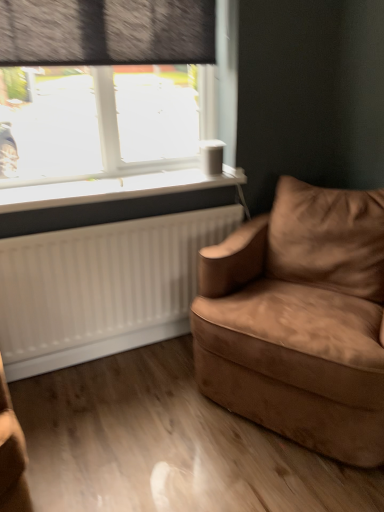
Find the location of a particular element. Image resolution: width=384 pixels, height=512 pixels. dark gray textured curtain at upper left is located at coordinates (106, 32).

The image size is (384, 512). Describe the element at coordinates (107, 32) in the screenshot. I see `transparent glass window at upper left` at that location.

Identify the location of dark gray textured curtain at upper left. (106, 32).

Is the surface of white plastic window sill at upper left in direct contact with suede brown armchair at right?

No.

Is suede brown armchair at right a part of white plastic window sill at upper left?

No.

Is white plastic window sill at upper left at the left side of suede brown armchair at right?

Indeed, white plastic window sill at upper left is positioned on the left side of suede brown armchair at right.

Is point (58, 17) closer or farther from the camera than point (191, 175)?

Point (58, 17) appears to be closer to the viewer than point (191, 175).

Do you think transparent glass window at upper left is within white plastic window sill at upper left, or outside of it?

transparent glass window at upper left is located beyond the bounds of white plastic window sill at upper left.

From the image's perspective, is transparent glass window at upper left above white plastic window sill at upper left?

Correct, transparent glass window at upper left appears higher than white plastic window sill at upper left in the image.

Considering the sizes of objects transparent glass window at upper left and white plastic window sill at upper left in the image provided, who is smaller, transparent glass window at upper left or white plastic window sill at upper left?

white plastic window sill at upper left is smaller.

Is white plastic window sill at upper left touching transparent glass window at upper left?

No, white plastic window sill at upper left is not making contact with transparent glass window at upper left.

Which object is closer to the camera, white plastic window sill at upper left or transparent glass window at upper left?

white plastic window sill at upper left.

From the image's perspective, is white plastic window sill at upper left positioned above or below transparent glass window at upper left?

Based on their image positions, white plastic window sill at upper left is located beneath transparent glass window at upper left.

Can you tell me how much white plastic window sill at upper left and transparent glass window at upper left differ in facing direction?

They differ by 0.0869 degrees in their facing directions.

Is the surface of suede brown armchair at right in direct contact with white plastic window sill at upper left?

No, suede brown armchair at right is not touching white plastic window sill at upper left.

Can you confirm if suede brown armchair at right is wider than white plastic window sill at upper left?

Correct, the width of suede brown armchair at right exceeds that of white plastic window sill at upper left.

Looking at this image, from a real-world perspective, is suede brown armchair at right positioned over white plastic window sill at upper left based on gravity?

No, from a real-world perspective, suede brown armchair at right is not over white plastic window sill at upper left

Is suede brown armchair at right behind white plastic window sill at upper left?

No, suede brown armchair at right is closer to the viewer.

Based on the photo, could you tell me if suede brown armchair at right is facing dark gray textured curtain at upper left?

No, suede brown armchair at right is not aimed at dark gray textured curtain at upper left.

Measure the distance from suede brown armchair at right to dark gray textured curtain at upper left.

They are 3.96 feet apart.

From the image's perspective, which object appears higher, suede brown armchair at right or dark gray textured curtain at upper left?

From the image's view, dark gray textured curtain at upper left is above.

From a real-world perspective, relative to dark gray textured curtain at upper left, is suede brown armchair at right vertically above or below?

From a real-world perspective, suede brown armchair at right is physically below dark gray textured curtain at upper left.

Is there a large distance between dark gray textured curtain at upper left and white plastic window sill at upper left?

No, dark gray textured curtain at upper left is not far from white plastic window sill at upper left.

From the picture: Considering the relative sizes of dark gray textured curtain at upper left and white plastic window sill at upper left in the image provided, is dark gray textured curtain at upper left smaller than white plastic window sill at upper left?

No.

How far apart are dark gray textured curtain at upper left and white plastic window sill at upper left?

dark gray textured curtain at upper left is 60.48 centimeters from white plastic window sill at upper left.

Between dark gray textured curtain at upper left and white plastic window sill at upper left, which one is positioned behind?

Positioned behind is white plastic window sill at upper left.

How different are the orientations of white plastic window sill at upper left and dark gray textured curtain at upper left in degrees?

white plastic window sill at upper left and dark gray textured curtain at upper left are facing 0.0217 degrees away from each other.

Is white plastic window sill at upper left situated inside dark gray textured curtain at upper left or outside?

white plastic window sill at upper left is not inside dark gray textured curtain at upper left, it's outside.

Considering the points (121, 197) and (105, 53), which point is behind, point (121, 197) or point (105, 53)?

The point (121, 197) is behind.

Does white plastic window sill at upper left come behind dark gray textured curtain at upper left?

Yes.

At what (x,y) coordinates should I click in order to perform the action: click on studio couch below the white plastic window sill at upper left (from the image's perspective). Please return your answer as a coordinate pair (x, y). Looking at the image, I should click on (300, 321).

At what (x,y) coordinates should I click in order to perform the action: click on window behind the white plastic window sill at upper left. Please return your answer as a coordinate pair (x, y). The width and height of the screenshot is (384, 512). Looking at the image, I should click on (107, 32).

Looking at this image, which object lies further to the anchor point transparent glass window at upper left, suede brown armchair at right or white plastic window sill at upper left?

suede brown armchair at right is further to transparent glass window at upper left.

Which object lies further to the anchor point suede brown armchair at right, dark gray textured curtain at upper left or transparent glass window at upper left?

transparent glass window at upper left is further to suede brown armchair at right.

Based on their spatial positions, is transparent glass window at upper left or dark gray textured curtain at upper left closer to white plastic window sill at upper left?

transparent glass window at upper left is positioned closer to the anchor white plastic window sill at upper left.

Which object lies nearer to the anchor point dark gray textured curtain at upper left, transparent glass window at upper left or suede brown armchair at right?

transparent glass window at upper left lies closer to dark gray textured curtain at upper left than the other object.

Considering their positions, is suede brown armchair at right positioned further to white plastic window sill at upper left than dark gray textured curtain at upper left?

suede brown armchair at right is further to white plastic window sill at upper left.

Considering their positions, is white plastic window sill at upper left positioned closer to transparent glass window at upper left than dark gray textured curtain at upper left?

Among the two, dark gray textured curtain at upper left is located nearer to transparent glass window at upper left.

Which object lies nearer to the anchor point transparent glass window at upper left, white plastic window sill at upper left or suede brown armchair at right?

Among the two, white plastic window sill at upper left is located nearer to transparent glass window at upper left.

From the image, which object appears to be farther from dark gray textured curtain at upper left, white plastic window sill at upper left or transparent glass window at upper left?

white plastic window sill at upper left.

Locate an element on the screen. The image size is (384, 512). window sill between transparent glass window at upper left and suede brown armchair at right from left to right is located at coordinates (114, 188).

The width and height of the screenshot is (384, 512). Find the location of `window that lies between dark gray textured curtain at upper left and white plastic window sill at upper left from top to bottom`. window that lies between dark gray textured curtain at upper left and white plastic window sill at upper left from top to bottom is located at coordinates (107, 32).

The width and height of the screenshot is (384, 512). Find the location of `window between dark gray textured curtain at upper left and suede brown armchair at right vertically`. window between dark gray textured curtain at upper left and suede brown armchair at right vertically is located at coordinates click(107, 32).

Locate an element on the screen. The image size is (384, 512). window sill between dark gray textured curtain at upper left and suede brown armchair at right from top to bottom is located at coordinates (114, 188).